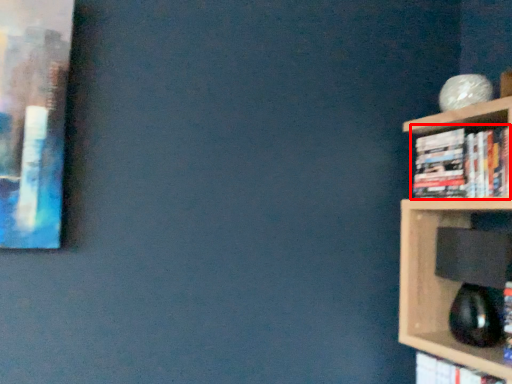
Question: From the image's perspective, considering the relative positions of book (annotated by the red box) and book in the image provided, where is book (annotated by the red box) located with respect to the staircase?

Choices:
 (A) below
 (B) above

Answer: (B)